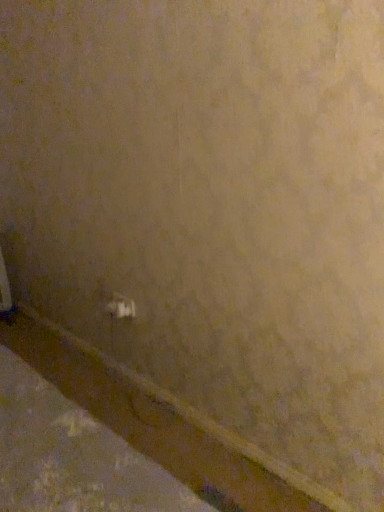
Question: Is white matte molding at lower left in front of or behind white plastic power plugs and sockets at lower center in the image?

Choices:
 (A) behind
 (B) front

Answer: (B)

Question: From a real-world perspective, is white matte molding at lower left positioned above or below white plastic power plugs and sockets at lower center?

Choices:
 (A) above
 (B) below

Answer: (B)

Question: Looking at their shapes, would you say white matte molding at lower left is wider or thinner than white plastic power plugs and sockets at lower center?

Choices:
 (A) wide
 (B) thin

Answer: (A)

Question: In the image, is white plastic power plugs and sockets at lower center on the left side or the right side of white matte molding at lower left?

Choices:
 (A) left
 (B) right

Answer: (B)

Question: In terms of height, does white plastic power plugs and sockets at lower center look taller or shorter compared to white matte molding at lower left?

Choices:
 (A) tall
 (B) short

Answer: (A)

Question: Is white plastic power plugs and sockets at lower center situated inside white matte molding at lower left or outside?

Choices:
 (A) inside
 (B) outside

Answer: (B)

Question: Considering the positions of white plastic power plugs and sockets at lower center and white matte molding at lower left in the image, is white plastic power plugs and sockets at lower center wider or thinner than white matte molding at lower left?

Choices:
 (A) wide
 (B) thin

Answer: (B)